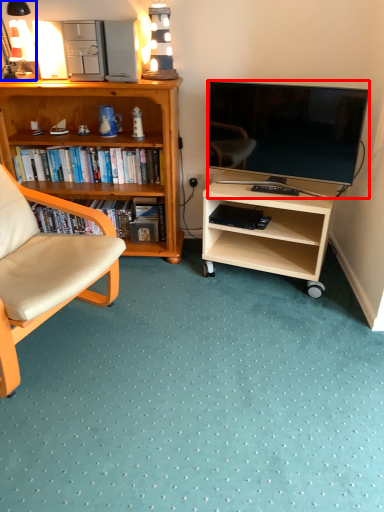
Question: Which point is closer to the camera, television (highlighted by a red box) or lamp (highlighted by a blue box)?

Choices:
 (A) television
 (B) lamp

Answer: (A)